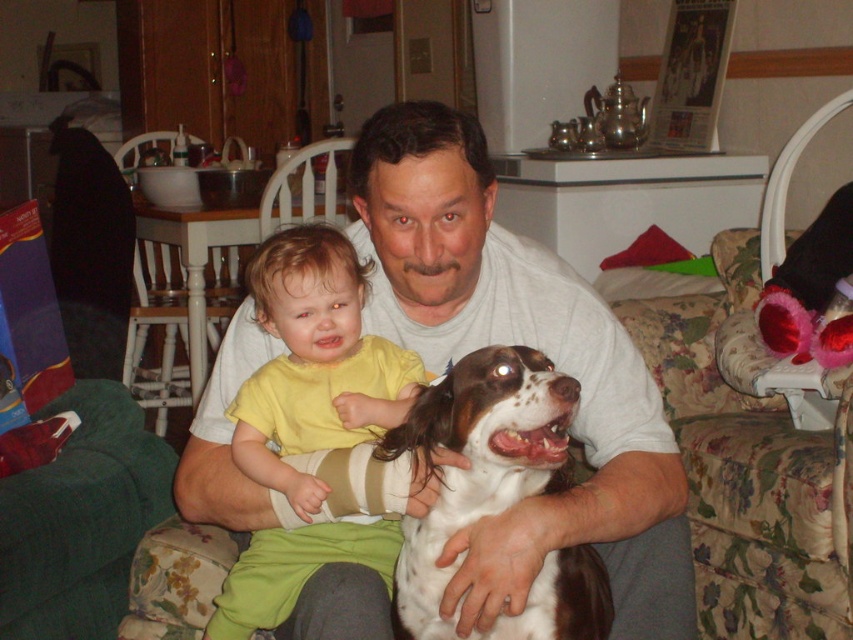
You are a photographer trying to capture a closeup of the white cotton shirt at center without the white speckled fur dog at center appearing in the shot. Based on their positions, is this possible?

The white speckled fur dog at center is behind the white cotton shirt at center, so you can take a closeup of the white cotton shirt at center without the dog appearing in the shot.

Looking at this image, you are standing in the living room and see two points marked in the image. Which point is closer to you, point [656,499] or point [468,365]?

Point [468,365] is closer to you because it is less further than point [656,499].